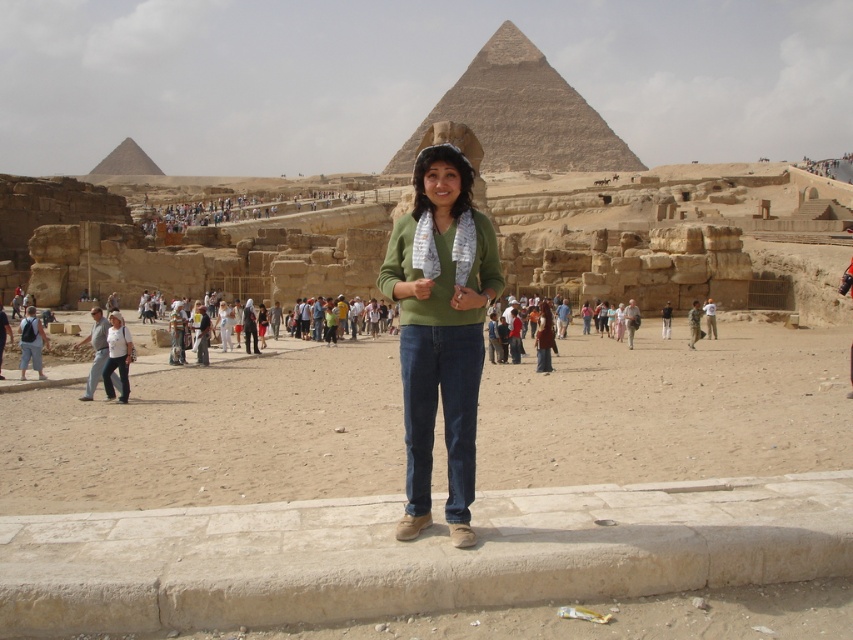
You are a tour guide at the Giza Plateau. You notice two tourists wearing a camouflage uniform at center and light blue jeans at center. Which clothing item is positioned lower on their body?

The camouflage uniform at center is located below the light blue jeans at center, so the camouflage uniform at center is positioned lower on their body.

You are a photographer standing at the Giza Plateau and want to capture a photo that includes both the point at coordinates point(440, 112) and point(691, 312). Based on their positions relative to you, which point is closer to your camera lens?

Point(440, 112) is closer to the camera lens than point(691, 312) because it is further to the camera than the other point.

You are a photographer trying to capture a clear shot of the green sweater at center and the light gray jeans at center. Based on their positions, which one should you focus on first to ensure both are in focus?

The light gray jeans at center is behind the green sweater at center, so you should focus on the light gray jeans at center first to ensure both are in focus.